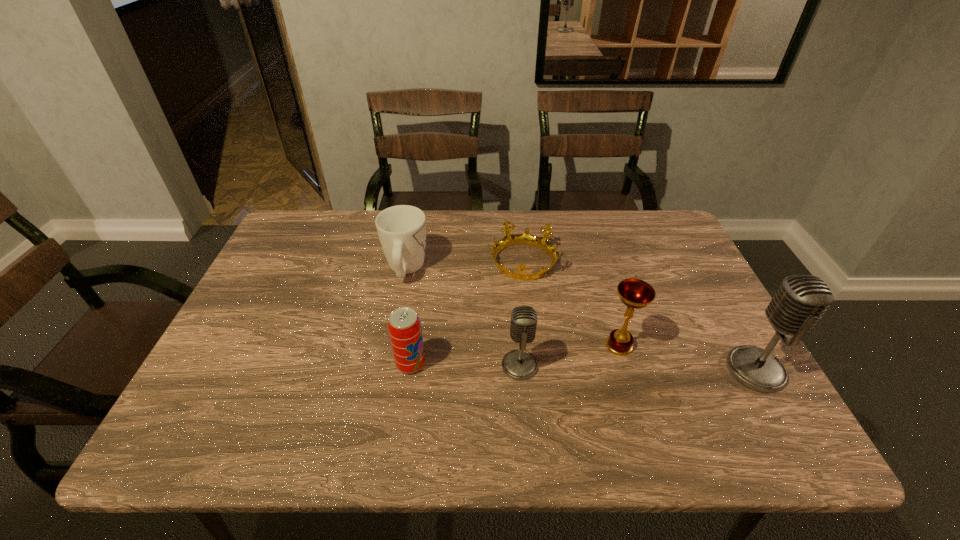
Locate an element on the screen. Image resolution: width=960 pixels, height=540 pixels. the left microphone is located at coordinates (519, 364).

The height and width of the screenshot is (540, 960). I want to click on the taller microphone, so click(x=800, y=302).

Find the location of a particular element. the right microphone is located at coordinates (800, 302).

Locate an element on the screen. This screenshot has width=960, height=540. mug is located at coordinates (401, 229).

Identify the location of crown. This screenshot has height=540, width=960. (526, 238).

Find the location of a particular element. chalice is located at coordinates (634, 293).

Find the location of a particular element. soda can is located at coordinates pos(404,326).

The height and width of the screenshot is (540, 960). I want to click on vacant space located on the left of the left microphone, so click(400, 366).

The width and height of the screenshot is (960, 540). In order to click on vacant space located 0.310m on the back of the right microphone in this screenshot , I will do `click(696, 264)`.

The image size is (960, 540). Identify the location of vacant point located 0.120m on the side of the mug with the handle. (414, 226).